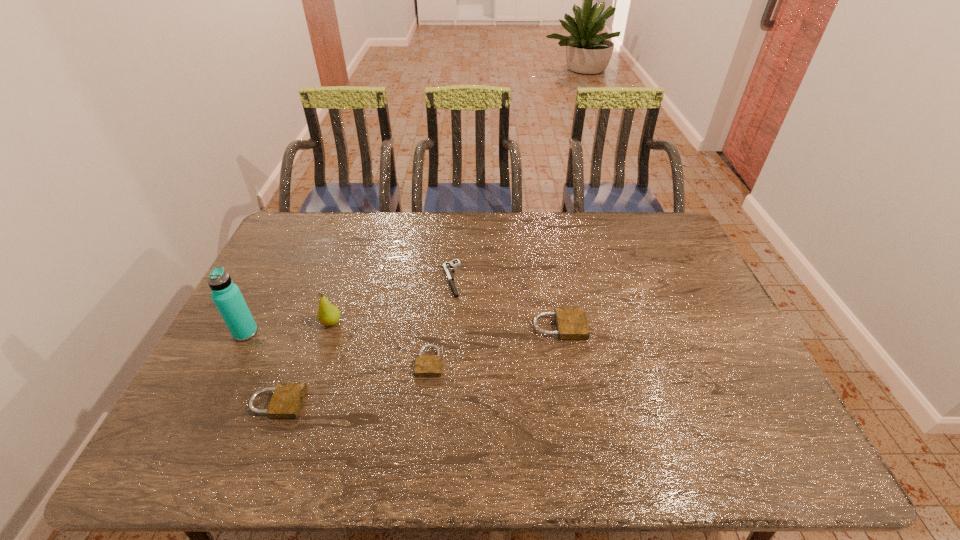
The width and height of the screenshot is (960, 540). What are the coordinates of `padlock that is at the left edge` in the screenshot? It's located at (287, 399).

The image size is (960, 540). I want to click on water bottle located at the left edge, so click(227, 297).

Find the location of `object positioned at the near left corner`. object positioned at the near left corner is located at coordinates (287, 399).

I want to click on free space at the far edge, so click(584, 231).

Identify the location of vacant space at the near edge. The height and width of the screenshot is (540, 960). (551, 402).

Image resolution: width=960 pixels, height=540 pixels. Identify the location of vacant area at the left edge. (254, 308).

The height and width of the screenshot is (540, 960). Identify the location of free space at the right edge. (654, 274).

Locate an element on the screen. The width and height of the screenshot is (960, 540). vacant space at the near left corner of the desktop is located at coordinates (208, 404).

You are a GUI agent. You are given a task and a screenshot of the screen. Output one action in this format:
    pyautogui.click(x=<x>, y=<y>)
    Task: Click on the free space at the far right corner of the desktop
    Image resolution: width=960 pixels, height=540 pixels.
    Given the screenshot: What is the action you would take?
    pyautogui.click(x=638, y=212)

I want to click on unoccupied position between the second shortest object and the farthest object, so click(x=440, y=320).